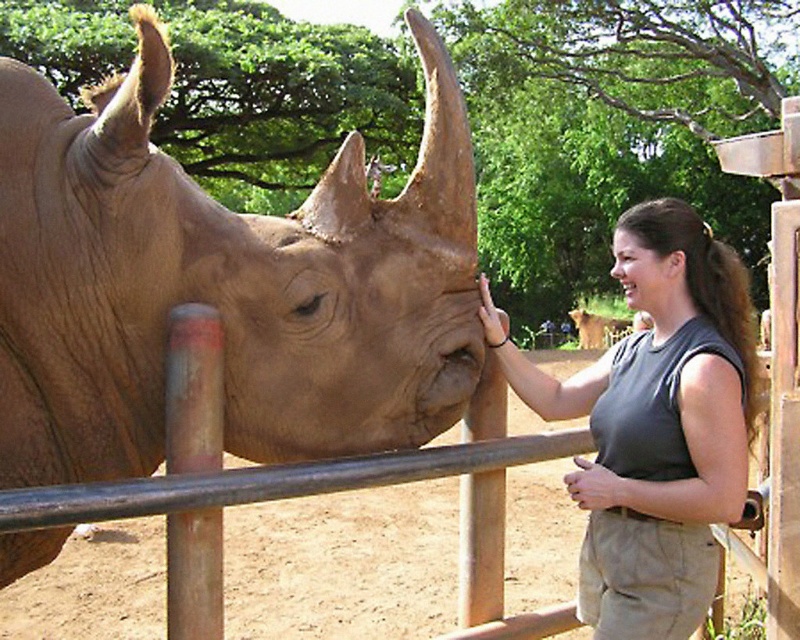
You are a zookeeper who needs to check the distance between the gray fabric shirt at center and the metal fence at center. Can you confirm if the distance is more than 50 centimeters?

The gray fabric shirt at center and the metal fence at center are 48.03 centimeters apart, which is less than 50 centimeters. Therefore, the distance is not more than 50 centimeters.